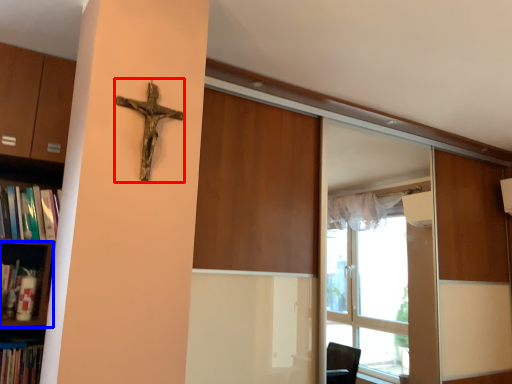
Question: Which object appears closest to the camera in this image, crucifix (highlighted by a red box) or shelf (highlighted by a blue box)?

Choices:
 (A) crucifix
 (B) shelf

Answer: (A)